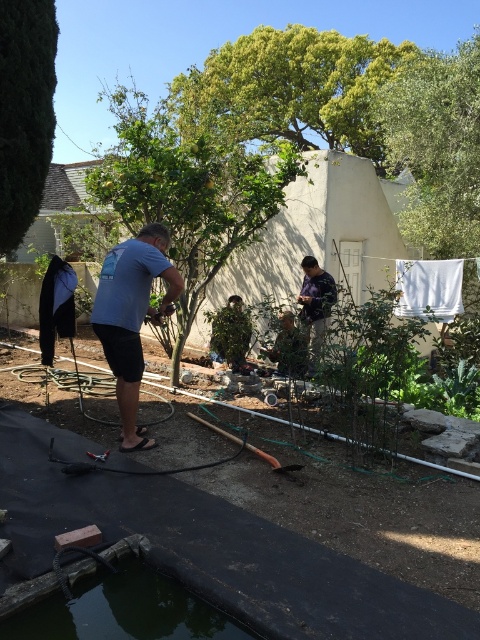
You are planning to place a new garden bench that is 1.2 meters wide in the garden. The dark green rubber pond at bottom left and the blue cotton shirt at center are already present. Which object should you avoid placing the bench next to to ensure it fits without overlapping?

The dark green rubber pond at bottom left has a larger width than the blue cotton shirt at center. Since the bench is 1.2 meters wide, you should avoid placing it next to the dark green rubber pond at bottom left as it may not leave enough space due to its greater width compared to the blue cotton shirt at center.

You are a drone operator trying to capture a photo of the blue cotton shirt at center without including the dark green rubber pond at bottom left in the frame. Based on their positions, is this possible?

The dark green rubber pond at bottom left is in front of the blue cotton shirt at center, so it would block the view. Therefore, capturing the blue cotton shirt at center without the dark green rubber pond at bottom left in the frame is not possible.